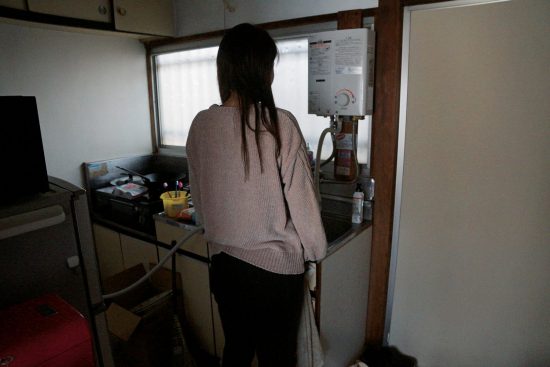
At what (x,y) coordinates should I click in order to perform the action: click on appliance of some kind (square white box). Please return your answer as a coordinate pair (x, y). This screenshot has height=367, width=550. Looking at the image, I should click on (336, 58).